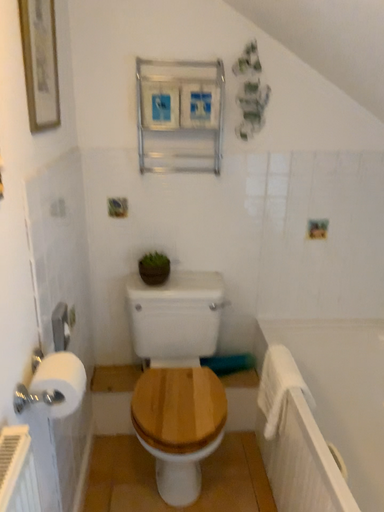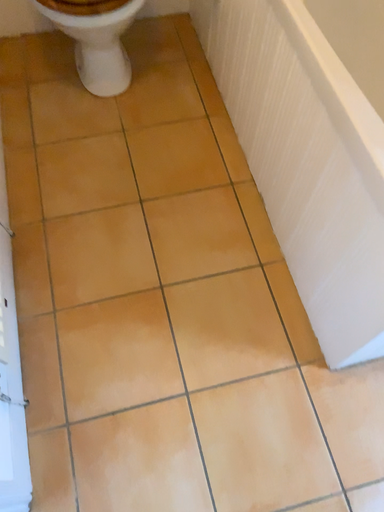
Question: Which way did the camera rotate in the video?

Choices:
 (A) rotated upward
 (B) rotated downward

Answer: (B)